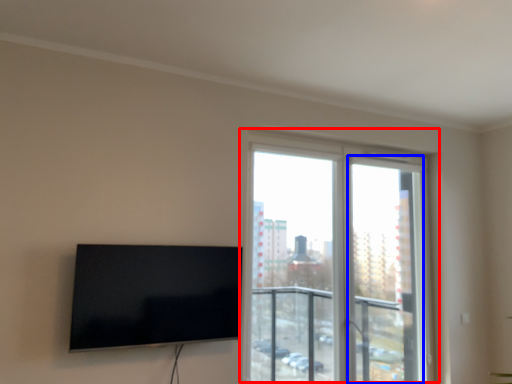
Question: Which object is closer to the camera taking this photo, window (highlighted by a red box) or screen door (highlighted by a blue box)?

Choices:
 (A) window
 (B) screen door

Answer: (A)